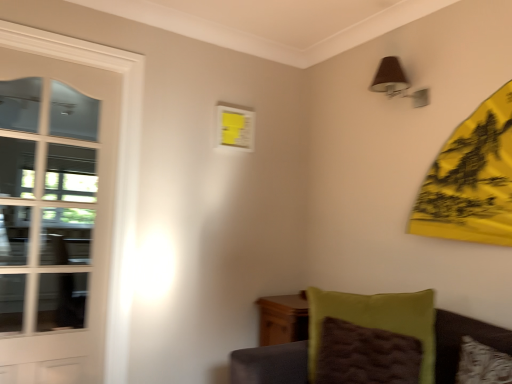
What do you see at coordinates (371, 337) in the screenshot?
I see `green fuzzy pillow at lower right` at bounding box center [371, 337].

Where is `green fuzzy pillow at lower right`? The width and height of the screenshot is (512, 384). green fuzzy pillow at lower right is located at coordinates (371, 337).

The image size is (512, 384). I want to click on velvet green cushion at lower right, so click(x=276, y=345).

The image size is (512, 384). Describe the element at coordinates (276, 345) in the screenshot. I see `velvet green cushion at lower right` at that location.

At what (x,y) coordinates should I click in order to perform the action: click on green fuzzy pillow at lower right. Please return your answer as a coordinate pair (x, y). Looking at the image, I should click on (371, 337).

From the image's perspective, which object appears higher, velvet green cushion at lower right or white glossy door at left?

white glossy door at left appears higher in the image.

Looking at this image, in the image, is velvet green cushion at lower right on the left side or the right side of white glossy door at left?

In the image, velvet green cushion at lower right appears on the right side of white glossy door at left.

Is velvet green cushion at lower right facing away from white glossy door at left?

velvet green cushion at lower right is not turned away from white glossy door at left.

From the image's perspective, is velvet green cushion at lower right above green fuzzy pillow at lower right?

No, from the image's perspective, velvet green cushion at lower right is not above green fuzzy pillow at lower right.

Is velvet green cushion at lower right turned away from green fuzzy pillow at lower right?

Yes.

Which object is further away from the camera taking this photo, velvet green cushion at lower right or green fuzzy pillow at lower right?

green fuzzy pillow at lower right is more distant.

Is velvet green cushion at lower right inside the boundaries of green fuzzy pillow at lower right, or outside?

velvet green cushion at lower right is not enclosed by green fuzzy pillow at lower right.

From a real-world perspective, is brown fabric lampshade at upper right located higher than velvet green cushion at lower right?

Yes.

Does point (400, 79) come closer to viewer compared to point (239, 378)?

No, it is behind (239, 378).

Between brown fabric lampshade at upper right and velvet green cushion at lower right, which one has larger width?

With larger width is velvet green cushion at lower right.

Based on their sizes in the image, would you say brown fabric lampshade at upper right is bigger or smaller than white glossy door at left?

In the image, brown fabric lampshade at upper right appears to be smaller than white glossy door at left.

Where is `light fixture above the white glossy door at left (from the image's perspective)`? The width and height of the screenshot is (512, 384). light fixture above the white glossy door at left (from the image's perspective) is located at coordinates (396, 82).

Is there a large distance between brown fabric lampshade at upper right and white glossy door at left?

Yes, brown fabric lampshade at upper right is far from white glossy door at left.

Do you think brown fabric lampshade at upper right is within white glossy door at left, or outside of it?

The correct answer is: outside.

Where is `door in front of the brown fabric lampshade at upper right`? door in front of the brown fabric lampshade at upper right is located at coordinates (x=56, y=207).

Is white glossy door at left further to the viewer compared to brown fabric lampshade at upper right?

No, white glossy door at left is closer to the viewer.

Is white glossy door at left next to brown fabric lampshade at upper right and touching it?

No, white glossy door at left is not beside brown fabric lampshade at upper right.

From a real-world perspective, is white glossy door at left below brown fabric lampshade at upper right?

Yes, from a real-world perspective, white glossy door at left is under brown fabric lampshade at upper right.

From a real-world perspective, who is located higher, white glossy door at left or green fuzzy pillow at lower right?

white glossy door at left, from a real-world perspective.

I want to click on pillow on the right of white glossy door at left, so click(x=371, y=337).

Considering the sizes of objects white glossy door at left and green fuzzy pillow at lower right in the image provided, who is shorter, white glossy door at left or green fuzzy pillow at lower right?

green fuzzy pillow at lower right is shorter.

From a real-world perspective, is white glossy door at left beneath velvet green cushion at lower right?

Actually, white glossy door at left is physically above velvet green cushion at lower right in the real world.

Does point (55, 263) come farther from viewer compared to point (271, 316)?

That is False.

Looking at their sizes, would you say white glossy door at left is wider or thinner than velvet green cushion at lower right?

Clearly, white glossy door at left has less width compared to velvet green cushion at lower right.

The height and width of the screenshot is (384, 512). What are the coordinates of `furniture below the white glossy door at left (from a real-world perspective)` in the screenshot? It's located at (276, 345).

This screenshot has width=512, height=384. Find the location of `furniture in front of the green fuzzy pillow at lower right`. furniture in front of the green fuzzy pillow at lower right is located at coordinates (276, 345).

From the image, which object appears to be nearer to white glossy door at left, velvet green cushion at lower right or green fuzzy pillow at lower right?

The object closer to white glossy door at left is green fuzzy pillow at lower right.

Considering their positions, is green fuzzy pillow at lower right positioned closer to velvet green cushion at lower right than white glossy door at left?

green fuzzy pillow at lower right is closer to velvet green cushion at lower right.

When comparing their distances from velvet green cushion at lower right, does white glossy door at left or green fuzzy pillow at lower right seem closer?

green fuzzy pillow at lower right.

Consider the image. When comparing their distances from brown fabric lampshade at upper right, does velvet green cushion at lower right or white glossy door at left seem further?

white glossy door at left lies further to brown fabric lampshade at upper right than the other object.

Considering their positions, is brown fabric lampshade at upper right positioned further to green fuzzy pillow at lower right than white glossy door at left?

Based on the image, white glossy door at left appears to be further to green fuzzy pillow at lower right.

From the image, which object appears to be farther from brown fabric lampshade at upper right, white glossy door at left or velvet green cushion at lower right?

white glossy door at left is further to brown fabric lampshade at upper right.

Based on their spatial positions, is green fuzzy pillow at lower right or white glossy door at left closer to brown fabric lampshade at upper right?

Among the two, green fuzzy pillow at lower right is located nearer to brown fabric lampshade at upper right.

Estimate the real-world distances between objects in this image. Which object is further from green fuzzy pillow at lower right, brown fabric lampshade at upper right or velvet green cushion at lower right?

brown fabric lampshade at upper right is further to green fuzzy pillow at lower right.

The image size is (512, 384). What are the coordinates of `pillow between white glossy door at left and brown fabric lampshade at upper right in the horizontal direction` in the screenshot? It's located at (371, 337).

I want to click on pillow between white glossy door at left and velvet green cushion at lower right, so click(x=371, y=337).

Where is `furniture between white glossy door at left and brown fabric lampshade at upper right in the horizontal direction`? furniture between white glossy door at left and brown fabric lampshade at upper right in the horizontal direction is located at coordinates (276, 345).

The height and width of the screenshot is (384, 512). What are the coordinates of `pillow between brown fabric lampshade at upper right and velvet green cushion at lower right in the up-down direction` in the screenshot? It's located at (371, 337).